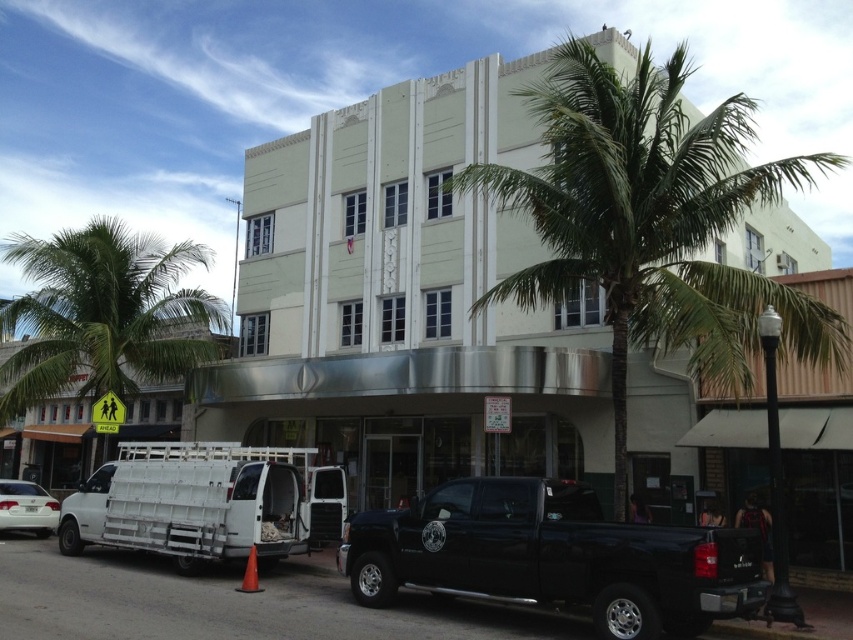
Question: Is green leafy palm tree at center positioned at the back of white matte sedan at lower left?

Choices:
 (A) no
 (B) yes

Answer: (A)

Question: Is green leafy palm tree at center thinner than green leafy palm tree at left?

Choices:
 (A) yes
 (B) no

Answer: (A)

Question: Estimate the real-world distances between objects in this image. Which object is closer to the white matte sedan at lower left?

Choices:
 (A) white matte van at lower left
 (B) black glossy truck at lower right
 (C) green leafy palm tree at center
 (D) green leafy palm tree at left

Answer: (A)

Question: Is green leafy palm tree at left above white matte van at lower left?

Choices:
 (A) no
 (B) yes

Answer: (B)

Question: Which point is farther from the camera taking this photo?

Choices:
 (A) (323, 484)
 (B) (450, 544)
 (C) (22, 525)
 (D) (113, 272)

Answer: (D)

Question: Which point appears farthest from the camera in this image?

Choices:
 (A) (190, 499)
 (B) (482, 577)
 (C) (20, 528)

Answer: (C)